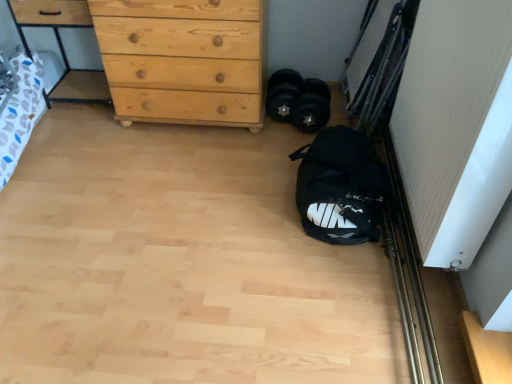
Find the location of a particular element. vacant space in front of black fabric sack at lower right is located at coordinates (313, 281).